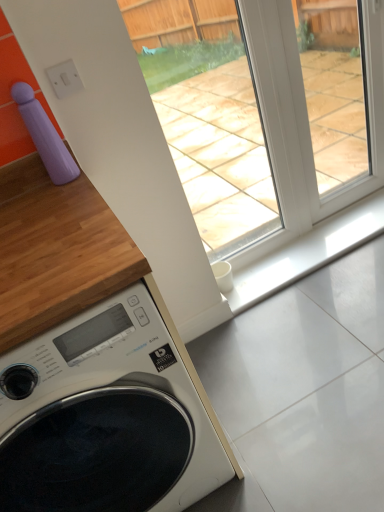
Question: Should I look upward or downward to see white glossy washing machine at lower left?

Choices:
 (A) down
 (B) up

Answer: (A)